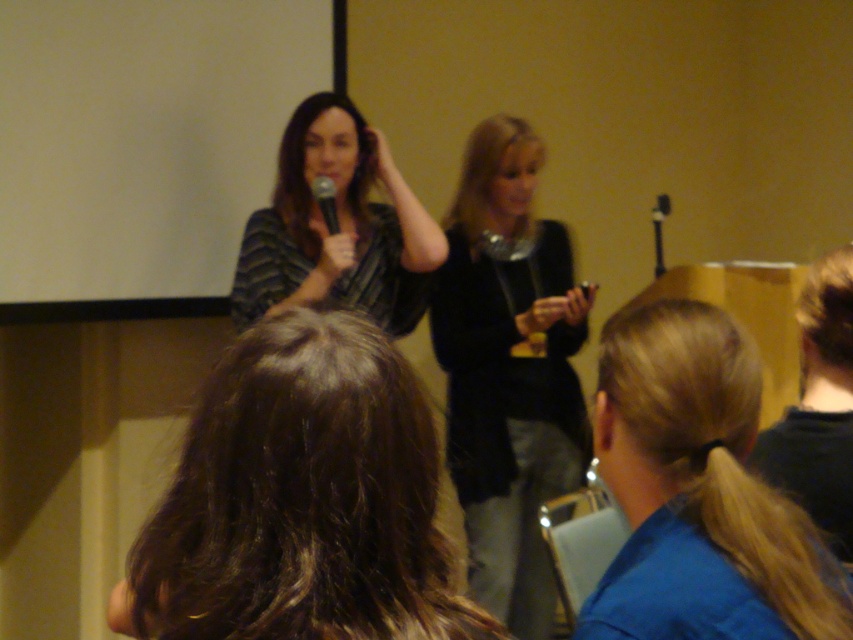
Question: Which of the following is the closest to the observer?

Choices:
 (A) black matte microphone at upper center
 (B) striped fabric shirt at center
 (C) black fuzzy sweater at center
 (D) dark brown hair at upper center

Answer: (D)

Question: Does blonde hair at upper center lie behind black fuzzy sweater at center?

Choices:
 (A) no
 (B) yes

Answer: (A)

Question: Is black fuzzy sweater at center to the left of striped fabric shirt at center from the viewer's perspective?

Choices:
 (A) yes
 (B) no

Answer: (B)

Question: Is dark brown hair at upper center to the right of striped fabric shirt at center from the viewer's perspective?

Choices:
 (A) yes
 (B) no

Answer: (A)

Question: Which point is closer to the camera?

Choices:
 (A) striped fabric shirt at center
 (B) black fuzzy sweater at center
 (C) blonde hair at upper center

Answer: (C)

Question: Considering the real-world distances, which object is closest to the dark brown hair at upper center?

Choices:
 (A) black matte microphone at upper center
 (B) black fuzzy sweater at center
 (C) striped fabric shirt at center
 (D) blonde hair at upper center

Answer: (D)